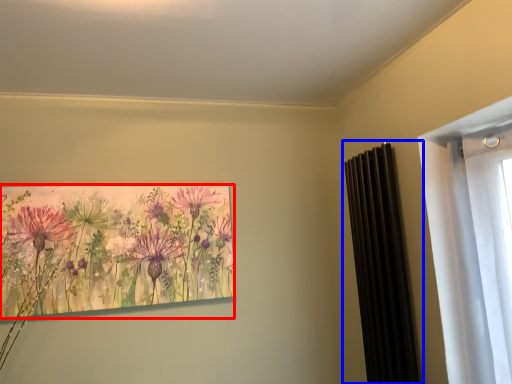
Question: Which point is closer to the camera, flower (highlighted by a red box) or radiator (highlighted by a blue box)?

Choices:
 (A) flower
 (B) radiator

Answer: (B)